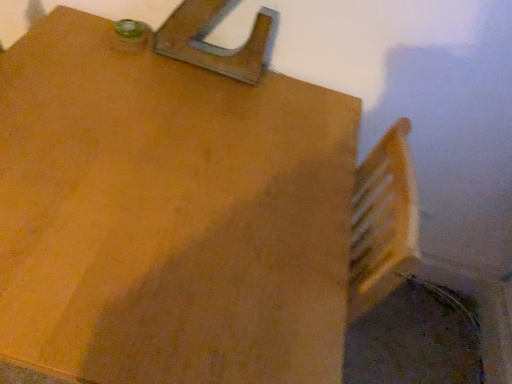
At what (x,y) coordinates should I click in order to perform the action: click on free space in front of wooden at upper center. Please return your answer as a coordinate pair (x, y). Image resolution: width=512 pixels, height=384 pixels. Looking at the image, I should click on (x=188, y=96).